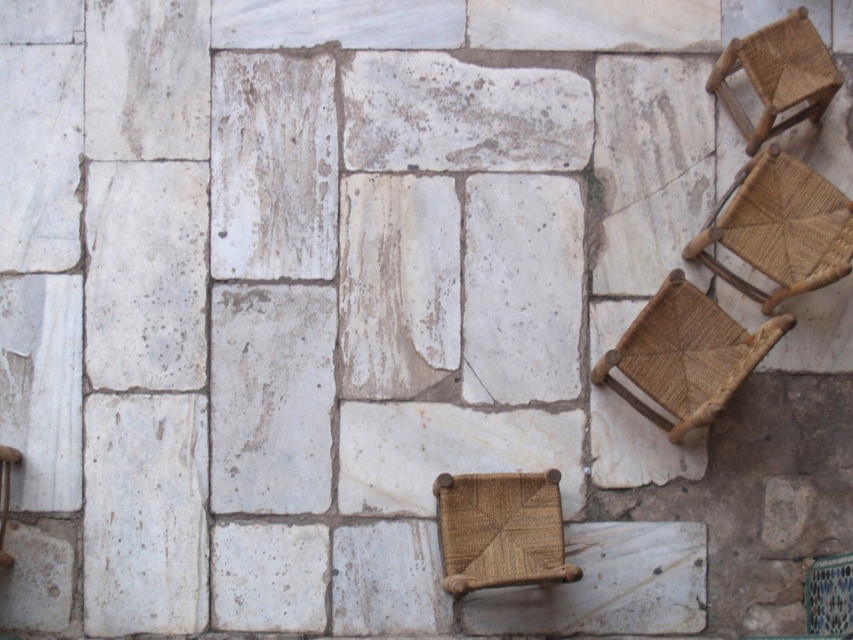
Question: Which of the following is the farthest from the observer?

Choices:
 (A) (399, 76)
 (B) (785, 292)
 (C) (822, 44)
 (D) (677, 316)

Answer: (A)

Question: Is woven brown stool at center closer to camera compared to woven straw chair at lower right?

Choices:
 (A) no
 (B) yes

Answer: (B)

Question: Can you confirm if brown woven chair at lower right is positioned to the left of woven straw chair at lower right?

Choices:
 (A) no
 (B) yes

Answer: (B)

Question: Does woven brown stool at center have a greater width compared to woven straw chair at lower right?

Choices:
 (A) no
 (B) yes

Answer: (B)

Question: Which object appears closest to the camera in this image?

Choices:
 (A) woven brown stool at upper right
 (B) woven brown stool at center

Answer: (B)

Question: Which of the following is the farthest from the observer?

Choices:
 (A) (500, 512)
 (B) (767, 268)
 (C) (819, 568)

Answer: (C)